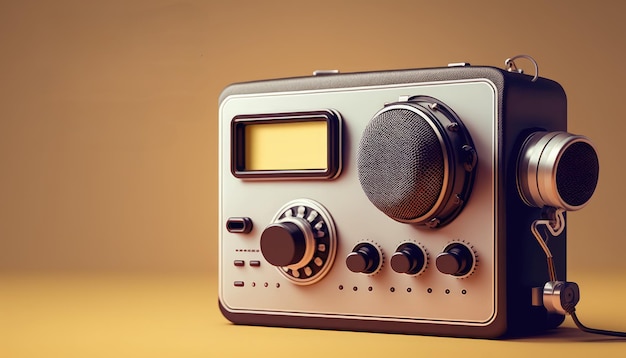
Locate an element on the screen. The height and width of the screenshot is (358, 626). big knob is located at coordinates (298, 233).